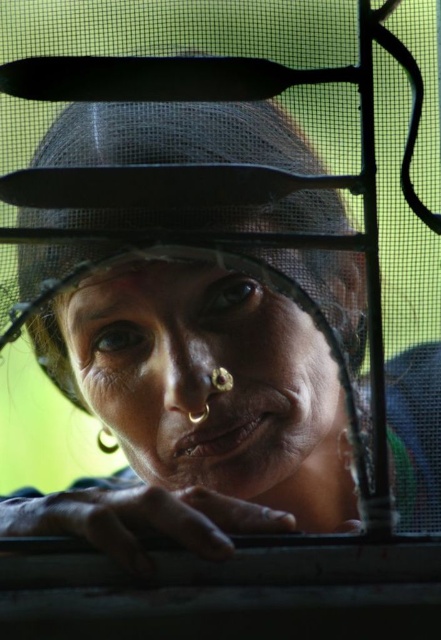
Does matte skin face at center have a greater height compared to matte black hat at center?

Incorrect, matte skin face at center's height is not larger of matte black hat at center's.

Who is shorter, matte skin face at center or matte black hat at center?

Standing shorter between the two is matte skin face at center.

At what (x,y) coordinates should I click in order to perform the action: click on matte skin face at center. Please return your answer as a coordinate pair (x, y). This screenshot has height=640, width=441. Looking at the image, I should click on (202, 376).

This screenshot has height=640, width=441. What are the coordinates of `matte skin face at center` in the screenshot? It's located at (202, 376).